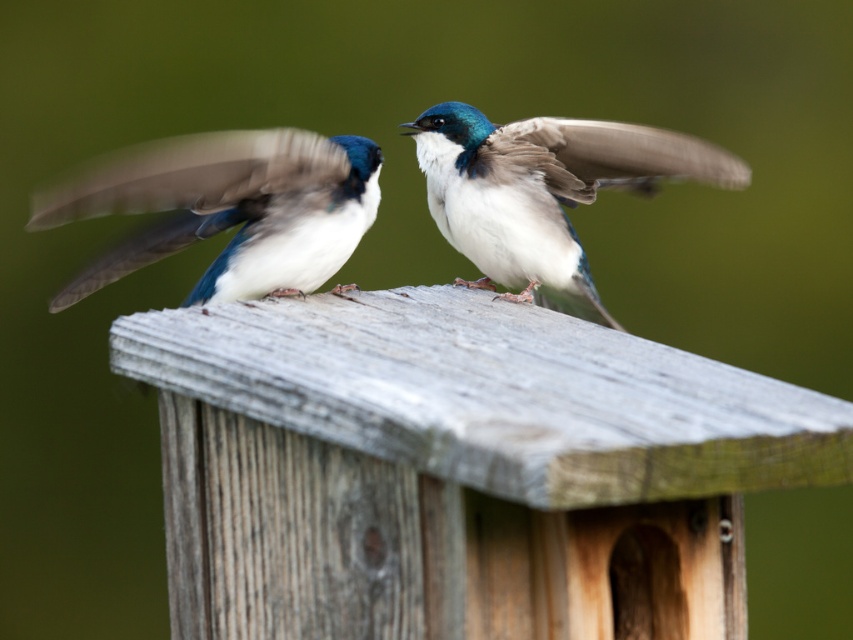
You are a birdwatcher trying to identify the birds in the image. You notice a point marked at coordinates (228, 209). What bird is located at that point?

The point at (228, 209) indicates a white matte bird at center.